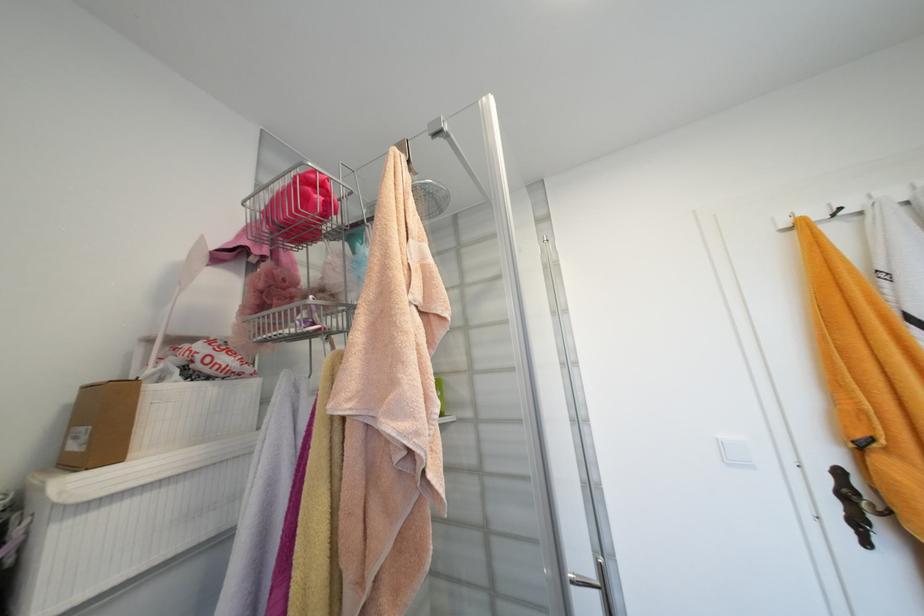
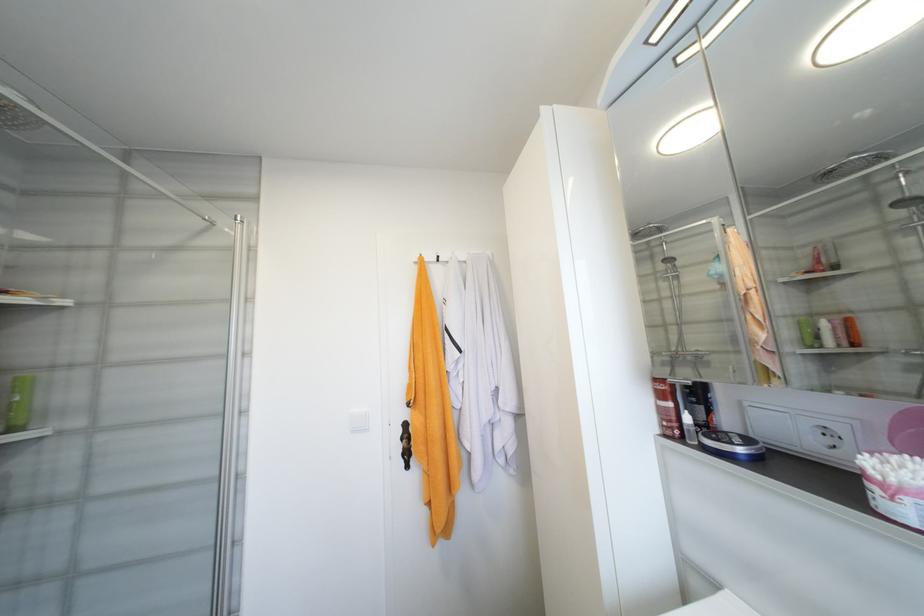
The point at (840, 507) is marked in the first image. Where is the corresponding point in the second image?

(405, 448)